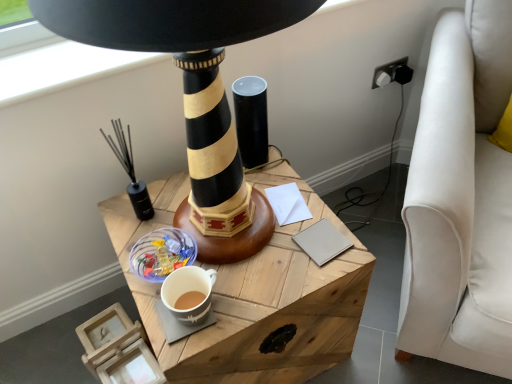
Locate an element on the screen. The height and width of the screenshot is (384, 512). vacant area to the right of black matte candle holder at left, which is the 2th candle holder from right to left is located at coordinates (180, 205).